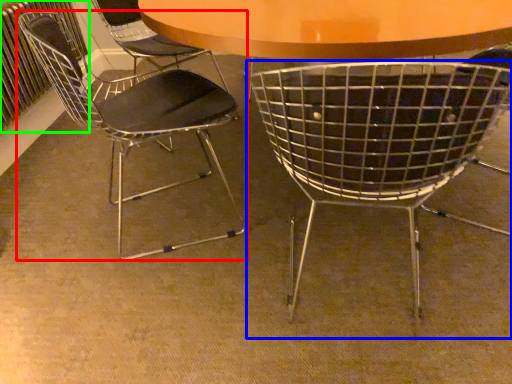
Question: Estimate the real-world distances between objects in this image. Which object is closer to chair (highlighted by a red box), chair (highlighted by a blue box) or radiator (highlighted by a green box)?

Choices:
 (A) chair
 (B) radiator

Answer: (B)